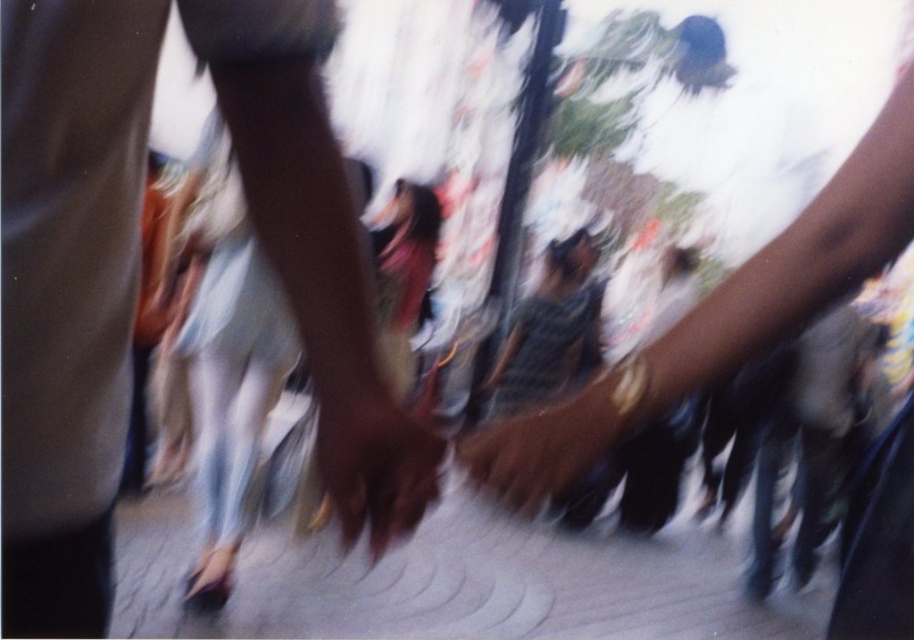
Is brown leather hand at center below smooth brown hand at center?

Yes, brown leather hand at center is below smooth brown hand at center.

Does brown leather hand at center have a lesser width compared to smooth brown hand at center?

In fact, brown leather hand at center might be wider than smooth brown hand at center.

Does point (603, 474) come farther from viewer compared to point (380, 529)?

Yes.

Identify the location of brown leather hand at center. This screenshot has height=640, width=914. (545, 452).

Is point (356, 236) in front of point (540, 465)?

That is False.

Is brown leather handbag at center positioned in front of brown leather hand at center?

Yes, brown leather handbag at center is closer to the viewer.

At what (x,y) coordinates should I click in order to perform the action: click on brown leather handbag at center. Please return your answer as a coordinate pair (x, y). The width and height of the screenshot is (914, 640). Looking at the image, I should click on (68, 294).

Looking at this image, who is more forward, [721,308] or [388,464]?

Positioned in front is point [388,464].

Can you confirm if smooth leather handbag at center is taller than smooth brown hand at center?

Yes, smooth leather handbag at center is taller than smooth brown hand at center.

Locate an element on the screen. smooth leather handbag at center is located at coordinates (724, 316).